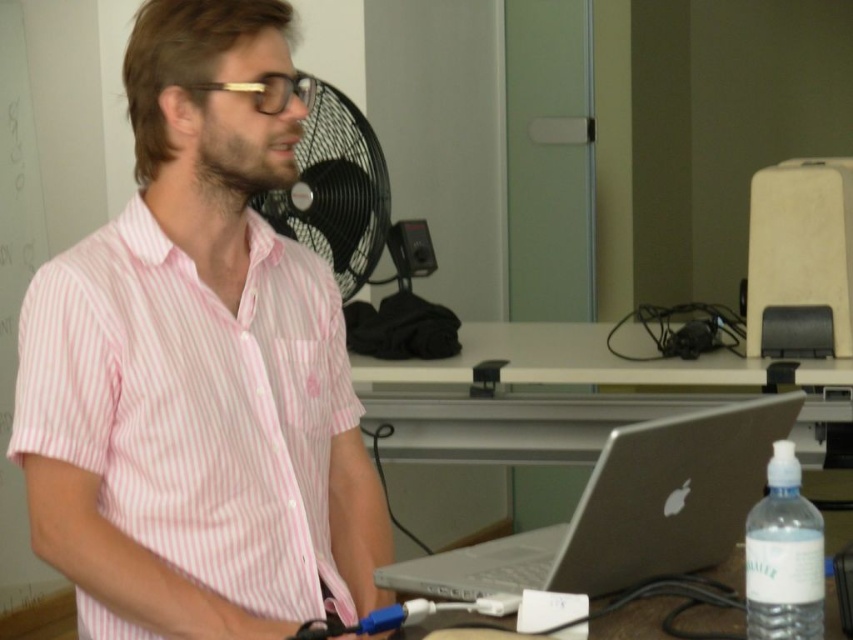
Which is more to the left, pink striped shirt at center or silver metallic laptop at center?

Positioned to the left is pink striped shirt at center.

Who is more distant from viewer, (45, 394) or (503, 573)?

The point (503, 573) is more distant.

Who is more distant from viewer, (x=219, y=132) or (x=647, y=436)?

The point (x=219, y=132) is more distant.

Locate an element on the screen. The width and height of the screenshot is (853, 640). pink striped shirt at center is located at coordinates (199, 365).

Does silver metallic laptop at center have a lesser width compared to black plastic fan at center?

No.

You are a GUI agent. You are given a task and a screenshot of the screen. Output one action in this format:
    pyautogui.click(x=<x>, y=<y>)
    Task: Click on the silver metallic laptop at center
    
    Given the screenshot: What is the action you would take?
    pyautogui.click(x=628, y=509)

Consider the image. Is silver metallic laptop at center to the right of clear plastic bottle at lower right from the viewer's perspective?

In fact, silver metallic laptop at center is to the left of clear plastic bottle at lower right.

Between silver metallic laptop at center and clear plastic bottle at lower right, which one appears on the right side from the viewer's perspective?

clear plastic bottle at lower right

The height and width of the screenshot is (640, 853). Describe the element at coordinates (628, 509) in the screenshot. I see `silver metallic laptop at center` at that location.

Identify the location of silver metallic laptop at center. This screenshot has width=853, height=640. (628, 509).